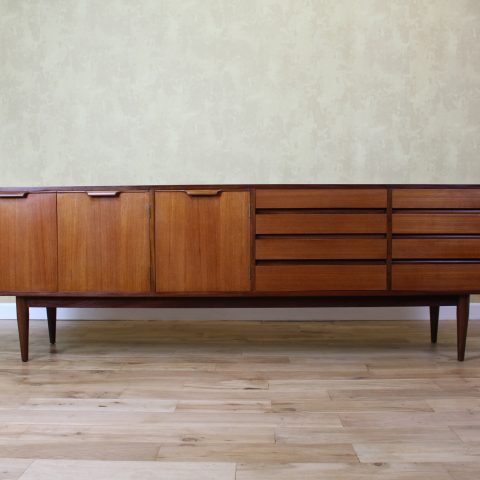
Where is `dark brown front cabinet legs`? The height and width of the screenshot is (480, 480). dark brown front cabinet legs is located at coordinates (22, 330), (462, 333).